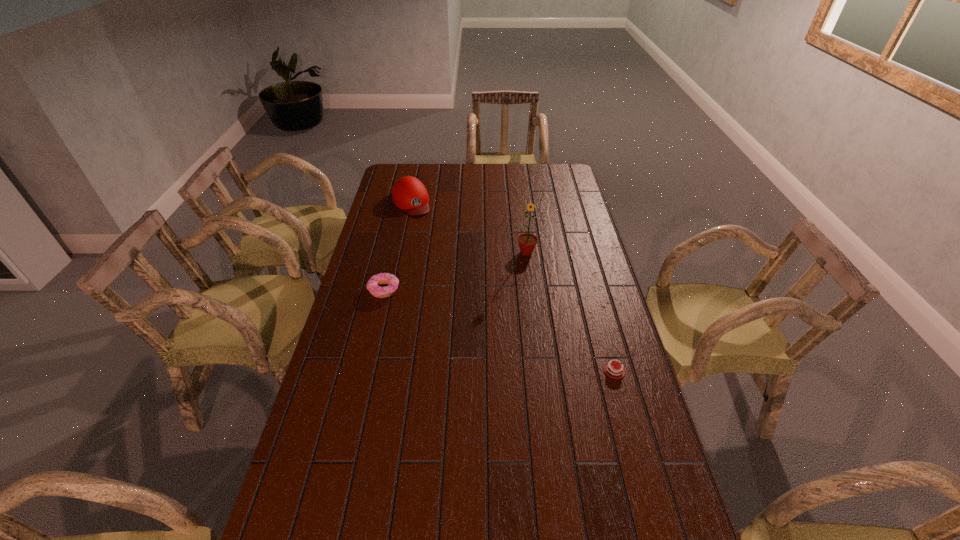
Where is `vacant space located 0.160m on the front-facing side of the farthest object`? The height and width of the screenshot is (540, 960). vacant space located 0.160m on the front-facing side of the farthest object is located at coordinates (430, 235).

Where is `vacant space located 0.120m on the front-facing side of the farthest object`? vacant space located 0.120m on the front-facing side of the farthest object is located at coordinates (426, 230).

Image resolution: width=960 pixels, height=540 pixels. Find the location of `vacant area situated 0.170m on the front-facing side of the farthest object`. vacant area situated 0.170m on the front-facing side of the farthest object is located at coordinates (431, 237).

This screenshot has height=540, width=960. I want to click on vacant area located 0.290m on the face of the sunflower, so click(517, 311).

You are a GUI agent. You are given a task and a screenshot of the screen. Output one action in this format:
    pyautogui.click(x=<x>, y=<y>)
    Task: Click on the free point located on the face of the sunflower
    
    Given the screenshot: What is the action you would take?
    pyautogui.click(x=523, y=276)

At what (x,y) coordinates should I click in order to perform the action: click on vacant area located 0.160m on the face of the sunflower. Please return your answer as a coordinate pair (x, y). The height and width of the screenshot is (540, 960). Looking at the image, I should click on (521, 286).

Locate an element on the screen. The height and width of the screenshot is (540, 960). doughnut positioned at the left edge is located at coordinates (375, 290).

Where is `baseball cap located at the left edge`? Image resolution: width=960 pixels, height=540 pixels. baseball cap located at the left edge is located at coordinates tap(409, 194).

You are a GUI agent. You are given a task and a screenshot of the screen. Output one action in this format:
    pyautogui.click(x=<x>, y=<y>)
    Task: Click on the object at the right edge
    This screenshot has height=540, width=960.
    Given the screenshot: What is the action you would take?
    pyautogui.click(x=609, y=368)

Image resolution: width=960 pixels, height=540 pixels. In the image, there is a desktop. Find the location of `vacant space at the far edge`. vacant space at the far edge is located at coordinates (535, 165).